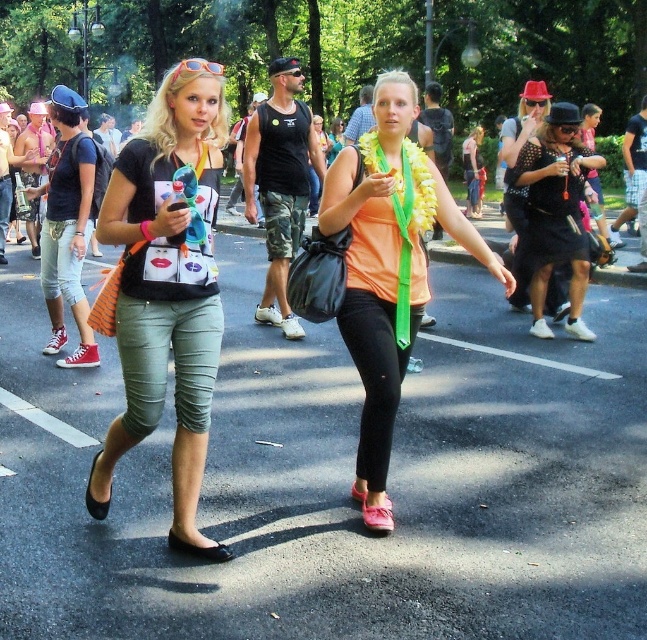
You are standing at the viewpoint of the image and want to walk to the point marked as point [177,547]. Is the point [554,163] blocking your path?

Point [554,163] is behind point [177,547], so it is not blocking your path.

You are a fashion designer observing the matte black shirt at left and the black leather flat shoe at lower center. Which item has a greater width?

The matte black shirt at left has a greater width than the black leather flat shoe at lower center.